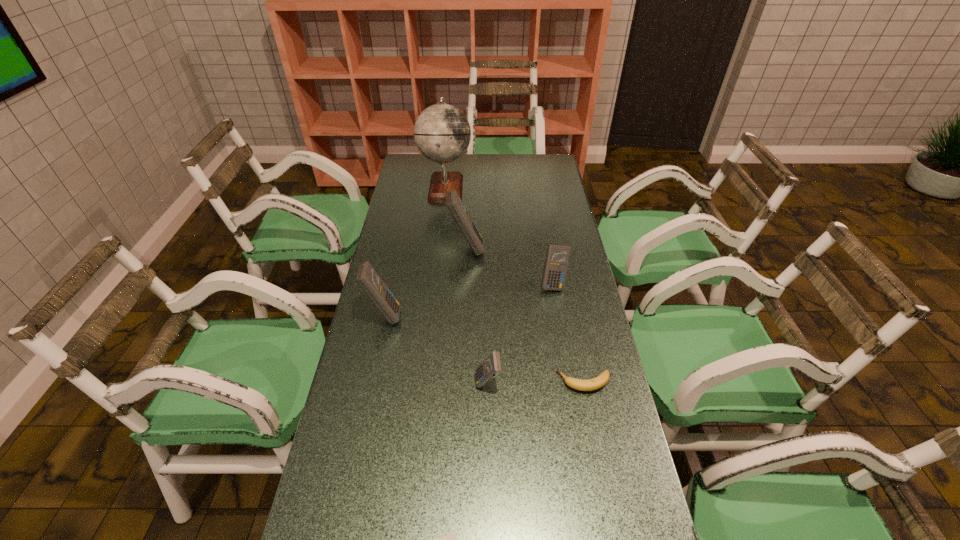
Find the location of a particular element. The width and height of the screenshot is (960, 540). object that is the closest to the third farthest blue calculator is located at coordinates [x=453, y=202].

Identify the location of calculator that is the fourth closest to the third tallest calculator. (450, 539).

You are a GUI agent. You are given a task and a screenshot of the screen. Output one action in this format:
    pyautogui.click(x=<x>, y=<y>)
    Task: Click on the third closest calculator to the nearest calculator
    This screenshot has height=540, width=960.
    Given the screenshot: What is the action you would take?
    pyautogui.click(x=557, y=257)

Identify which blue calculator is the closest to the fourth tallest calculator. Please provide its 2D coordinates. Your answer should be formatted as a tuple, i.e. [(x, y)], where the tuple contains the x and y coordinates of a point satisfying the conditions above.

[(367, 278)]

At what (x,y) coordinates should I click in order to perform the action: click on the closest blue calculator to the third smallest blue calculator. Please return your answer as a coordinate pair (x, y). This screenshot has width=960, height=540. Looking at the image, I should click on (453, 202).

Where is `free space that satisfies the following two spatial constraints: 1. on the front-facing side of the third shortest calculator; 2. on the front-facing side of the smallest blue calculator`? This screenshot has width=960, height=540. free space that satisfies the following two spatial constraints: 1. on the front-facing side of the third shortest calculator; 2. on the front-facing side of the smallest blue calculator is located at coordinates (571, 383).